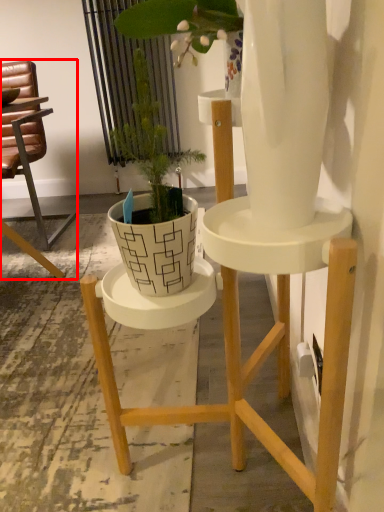
Question: In this image, where is chair (annotated by the red box) located relative to houseplant?

Choices:
 (A) right
 (B) left

Answer: (B)